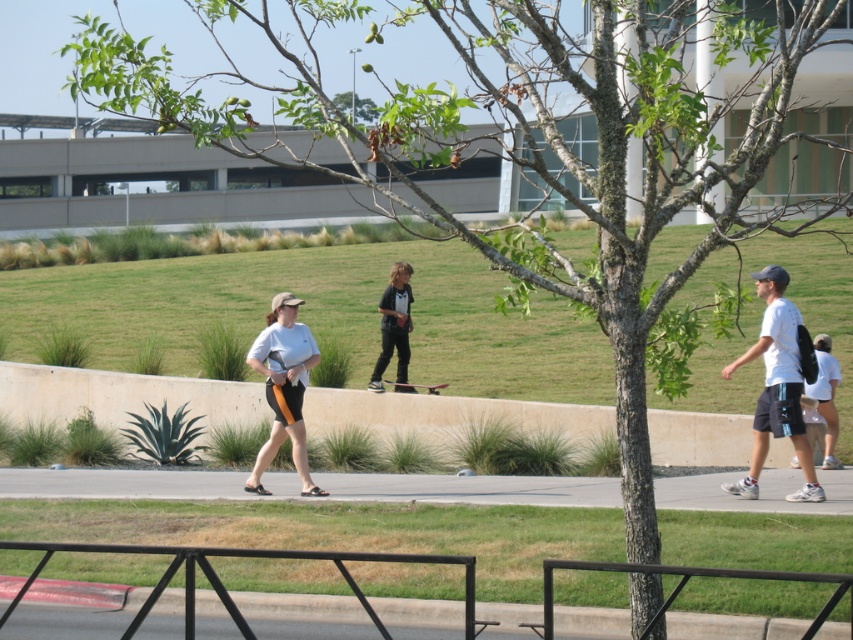
You are standing at the point marked as gray asphalt pavement at lower center. Looking around, which direction would you face to see the tree with sparse green leaves?

The tree with sparse green leaves is positioned slightly off center, so you would need to turn your head slightly to the left to see it from the gray asphalt pavement at lower center.

You are standing at point A, which is at coordinates point (578, 481). You want to walk to point B, which is at coordinates point (779, 332). However, there is a large tree blocking your path. Can you see point B from your current position at point A?

Point (578, 481) is behind point (779, 332). Since the tree is positioned in the foreground and partially obscuring the background, you cannot see point B from point A as it is blocked by the tree.